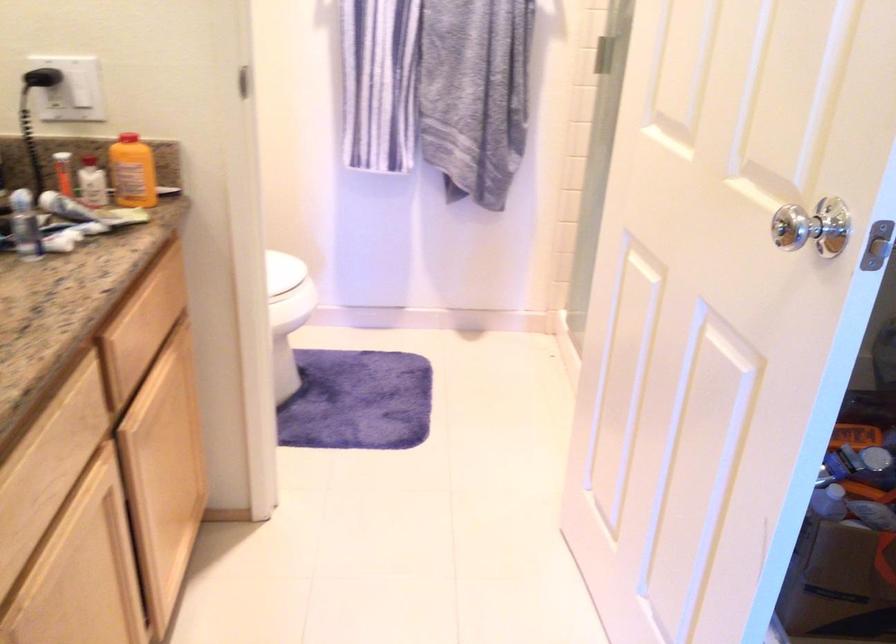
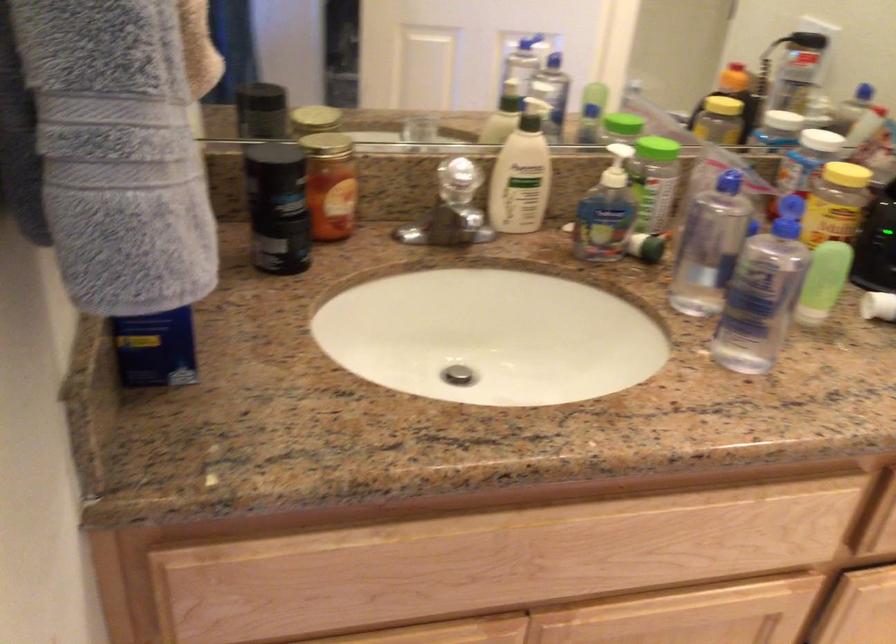
First-person continuous shooting, in which direction is the camera rotating?

The camera rotated toward left-down.